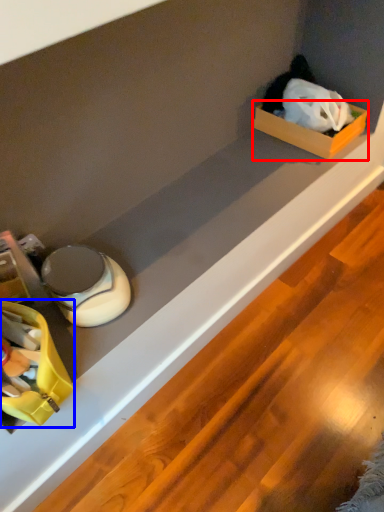
Question: Which object appears closest to the camera in this image, box (highlighted by a red box) or storage box (highlighted by a blue box)?

Choices:
 (A) box
 (B) storage box

Answer: (B)